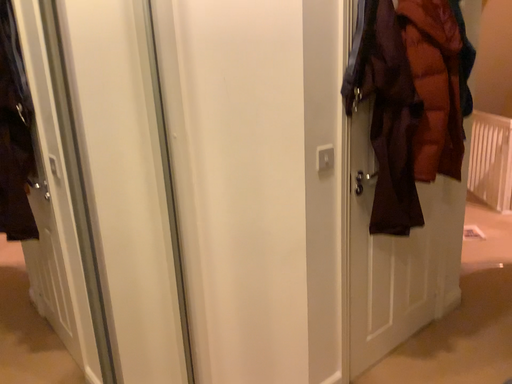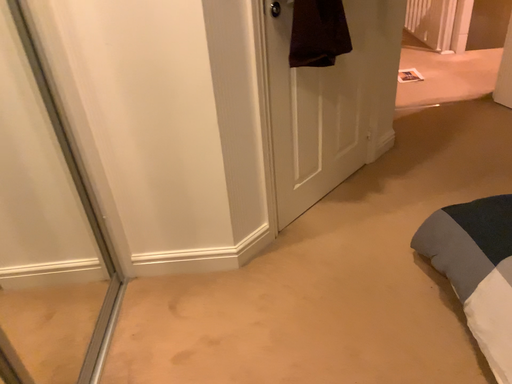
Question: Which way did the camera rotate in the video?

Choices:
 (A) rotated downward
 (B) rotated upward

Answer: (A)